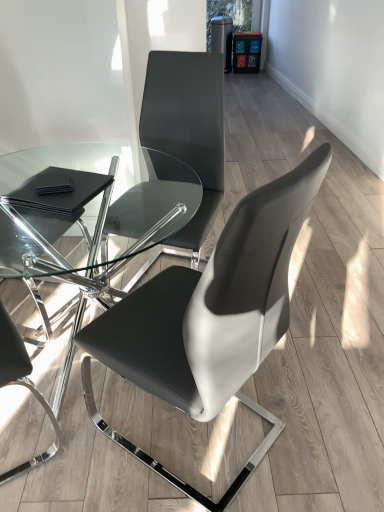
What do you see at coordinates (188, 127) in the screenshot? I see `matte black chair at center, which is the 2th chair in left-to-right order` at bounding box center [188, 127].

What is the approximate width of transparent glass table at center?

It is 93.31 centimeters.

Describe the element at coordinates (46, 225) in the screenshot. I see `black leather chair at left, arranged as the 3th chair when viewed from the right` at that location.

This screenshot has width=384, height=512. What are the coordinates of `matte black chair at center, marked as the 2th chair in a right-to-left arrangement` in the screenshot? It's located at (188, 127).

Is matte black chair at center, which is the 2th chair in left-to-right order, surrounding black leather pads at lower left?

No, matte black chair at center, which is the 2th chair in left-to-right order, does not contain black leather pads at lower left.

Who is more distant, matte black chair at center, marked as the 2th chair in a right-to-left arrangement, or black leather pads at lower left?

matte black chair at center, marked as the 2th chair in a right-to-left arrangement.

This screenshot has width=384, height=512. Find the location of `pad that is on the left side of matte black chair at center, marked as the 2th chair in a right-to-left arrangement`. pad that is on the left side of matte black chair at center, marked as the 2th chair in a right-to-left arrangement is located at coordinates (59, 190).

Who is smaller, matte black chair at center, which is the 2th chair in left-to-right order, or black leather pads at lower left?

black leather pads at lower left is smaller.

From a real-world perspective, count 2nd chairs upward from the transparent glass table at center and point to it. Please provide its 2D coordinates.

[(188, 127)]

Considering the positions of point (65, 230) and point (164, 104), is point (65, 230) closer or farther from the camera than point (164, 104)?

Point (65, 230) is farther from the camera than point (164, 104).

Looking at this image, considering the sizes of objects transparent glass table at center and matte black chair at center, which is the 2th chair in left-to-right order, in the image provided, who is bigger, transparent glass table at center or matte black chair at center, which is the 2th chair in left-to-right order,?

With larger size is transparent glass table at center.

From a real-world perspective, does transparent glass table at center sit lower than matte black chair at center, which is the 2th chair in left-to-right order?

Yes, from a real-world perspective, transparent glass table at center is below matte black chair at center, which is the 2th chair in left-to-right order.

From the image's perspective, is transparent glass table at center located above matte black chair at center, the 3th chair viewed from the left?

Correct, transparent glass table at center appears higher than matte black chair at center, the 3th chair viewed from the left, in the image.

Is transparent glass table at center positioned beyond the bounds of matte black chair at center, the 3th chair viewed from the left?

Absolutely, transparent glass table at center is external to matte black chair at center, the 3th chair viewed from the left.

Could you tell me if transparent glass table at center is turned towards matte black chair at center, the 3th chair viewed from the left?

Yes, transparent glass table at center is facing matte black chair at center, the 3th chair viewed from the left.

Considering the positions of points (92, 212) and (270, 278), is point (92, 212) farther from camera compared to point (270, 278)?

Yes, point (92, 212) is behind point (270, 278).

Locate an element on the screen. The height and width of the screenshot is (512, 384). pad lying behind the black leather chair at left, arranged as the 3th chair when viewed from the right is located at coordinates (59, 190).

Based on their positions, is black leather chair at left, arranged as the 3th chair when viewed from the right, located to the left or right of black leather pads at lower left?

Based on their positions, black leather chair at left, arranged as the 3th chair when viewed from the right, is located to the left of black leather pads at lower left.

Is black leather chair at left, which is the first chair from left to right, completely or partially outside of black leather pads at lower left?

black leather chair at left, which is the first chair from left to right, lies outside black leather pads at lower left's area.

Are black leather chair at left, which is the first chair from left to right, and black leather pads at lower left beside each other?

black leather chair at left, which is the first chair from left to right, and black leather pads at lower left are not in contact.

Measure the distance between black leather chair at left, which is the first chair from left to right, and matte black chair at center, the 3th chair viewed from the left.

The distance of black leather chair at left, which is the first chair from left to right, from matte black chair at center, the 3th chair viewed from the left, is 23.49 inches.

Which point is more forward, (58, 220) or (170, 480)?

The point (170, 480) is closer to the camera.

In the image, is black leather chair at left, arranged as the 3th chair when viewed from the right, positioned in front of or behind matte black chair at center, which is counted as the first chair, starting from the right?

In the image, black leather chair at left, arranged as the 3th chair when viewed from the right, appears behind matte black chair at center, which is counted as the first chair, starting from the right.

Identify the location of chair lying below the black leather chair at left, arranged as the 3th chair when viewed from the right (from the image's perspective). (210, 318).

Which of these two, black leather chair at left, which is the first chair from left to right, or transparent glass table at center, is wider?

With larger width is transparent glass table at center.

From a real-world perspective, who is located higher, black leather chair at left, which is the first chair from left to right, or transparent glass table at center?

black leather chair at left, which is the first chair from left to right.

Between black leather chair at left, arranged as the 3th chair when viewed from the right, and transparent glass table at center, which one has more height?

With more height is black leather chair at left, arranged as the 3th chair when viewed from the right.

What's the angular difference between black leather chair at left, arranged as the 3th chair when viewed from the right, and transparent glass table at center's facing directions?

They differ by 19.7 degrees in their facing directions.

Is black leather chair at left, which is the first chair from left to right, closer to camera compared to matte black chair at center, which is the 2th chair in left-to-right order?

That is True.

Does point (62, 263) come in front of point (193, 138)?

No, it is behind (193, 138).

Is black leather chair at left, arranged as the 3th chair when viewed from the right, located outside matte black chair at center, which is the 2th chair in left-to-right order?

Yes, black leather chair at left, arranged as the 3th chair when viewed from the right, is not within matte black chair at center, which is the 2th chair in left-to-right order.

The width and height of the screenshot is (384, 512). Identify the location of the 1st chair counting from the right of the black leather pads at lower left. (188, 127).

Image resolution: width=384 pixels, height=512 pixels. I want to click on table located underneath the matte black chair at center, which is the 2th chair in left-to-right order (from a real-world perspective), so click(x=87, y=218).

Looking at the image, which one is located further to matte black chair at center, marked as the 2th chair in a right-to-left arrangement, black leather chair at left, which is the first chair from left to right, or transparent glass table at center?

black leather chair at left, which is the first chair from left to right, lies further to matte black chair at center, marked as the 2th chair in a right-to-left arrangement, than the other object.

From the picture: Considering their positions, is black leather chair at left, arranged as the 3th chair when viewed from the right, positioned closer to transparent glass table at center than black leather pads at lower left?

Based on the image, black leather chair at left, arranged as the 3th chair when viewed from the right, appears to be nearer to transparent glass table at center.

Looking at the image, which one is located closer to matte black chair at center, marked as the 2th chair in a right-to-left arrangement, matte black chair at center, which is counted as the first chair, starting from the right, or transparent glass table at center?

transparent glass table at center is positioned closer to the anchor matte black chair at center, marked as the 2th chair in a right-to-left arrangement.

From the image, which object appears to be nearer to black leather pads at lower left, matte black chair at center, the 3th chair viewed from the left, or matte black chair at center, which is the 2th chair in left-to-right order?

matte black chair at center, the 3th chair viewed from the left, is closer to black leather pads at lower left.

From the image, which object appears to be nearer to black leather pads at lower left, matte black chair at center, marked as the 2th chair in a right-to-left arrangement, or matte black chair at center, the 3th chair viewed from the left?

matte black chair at center, the 3th chair viewed from the left, lies closer to black leather pads at lower left than the other object.

Which object lies further to the anchor point black leather chair at left, arranged as the 3th chair when viewed from the right, matte black chair at center, which is counted as the first chair, starting from the right, or matte black chair at center, marked as the 2th chair in a right-to-left arrangement?

matte black chair at center, which is counted as the first chair, starting from the right.

Consider the image. Based on their spatial positions, is matte black chair at center, the 3th chair viewed from the left, or black leather pads at lower left closer to black leather chair at left, which is the first chair from left to right?

black leather pads at lower left.

Considering their positions, is matte black chair at center, the 3th chair viewed from the left, positioned further to matte black chair at center, marked as the 2th chair in a right-to-left arrangement, than black leather chair at left, which is the first chair from left to right?

matte black chair at center, the 3th chair viewed from the left, is positioned further to the anchor matte black chair at center, marked as the 2th chair in a right-to-left arrangement.

At what (x,y) coordinates should I click in order to perform the action: click on table between matte black chair at center, which is counted as the first chair, starting from the right, and matte black chair at center, which is the 2th chair in left-to-right order, in the front-back direction. Please return your answer as a coordinate pair (x, y). The height and width of the screenshot is (512, 384). Looking at the image, I should click on (87, 218).

The image size is (384, 512). I want to click on table between black leather chair at left, arranged as the 3th chair when viewed from the right, and matte black chair at center, marked as the 2th chair in a right-to-left arrangement, from left to right, so click(87, 218).

This screenshot has width=384, height=512. In order to click on table between black leather chair at left, arranged as the 3th chair when viewed from the right, and matte black chair at center, the 3th chair viewed from the left, from left to right in this screenshot , I will do `click(87, 218)`.

You are a GUI agent. You are given a task and a screenshot of the screen. Output one action in this format:
    pyautogui.click(x=<x>, y=<y>)
    Task: Click on the pad between black leather chair at left, which is the first chair from left to right, and matte black chair at center, marked as the 2th chair in a right-to-left arrangement, in the horizontal direction
    Image resolution: width=384 pixels, height=512 pixels.
    Given the screenshot: What is the action you would take?
    pyautogui.click(x=59, y=190)